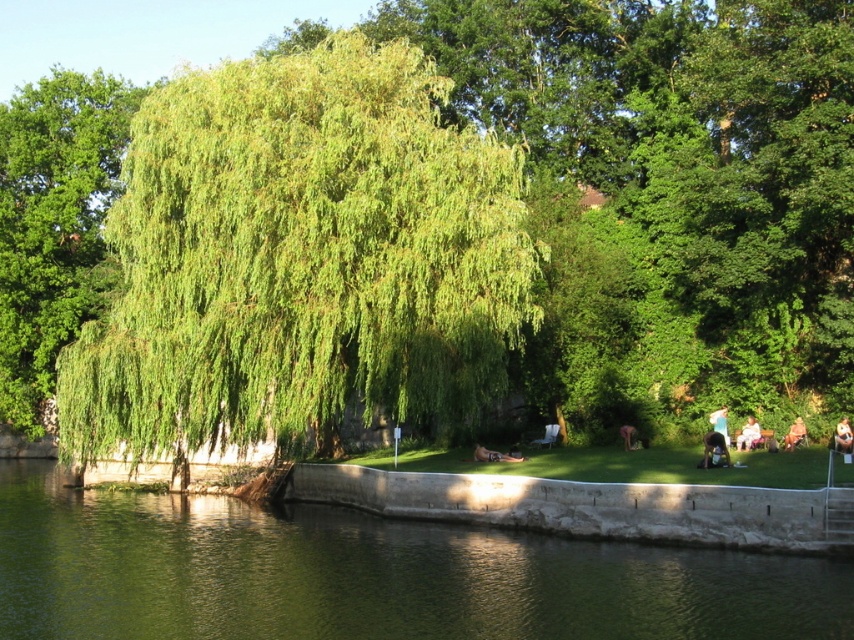
You are a photographer trying to capture the entire green leafy willow at center and the light brown fabric bag at lower right in a single frame. Based on their sizes, do you think the willow will appear larger than the bag in the photo?

The green leafy willow at center might be wider than light brown fabric bag at lower right, so it is possible that the willow will appear larger in the photo.

You are standing at the riverside and want to walk from point A to point B. Point A is at coordinates point (840, 426) and point B is at point (478, 451). Given that the path between them is along the embankment, which direction should you face to move towards point B from point A?

To move from point A at coordinates point (840, 426) to point B at point (478, 451), you should face towards the lower right direction since point B is closer to the viewer compared to point A.

You are standing at the point marked by the coordinates [843,436] in the riverside scene. What object is exactly at your current location?

The light brown fabric bag at lower right is exactly at the coordinates [843,436].